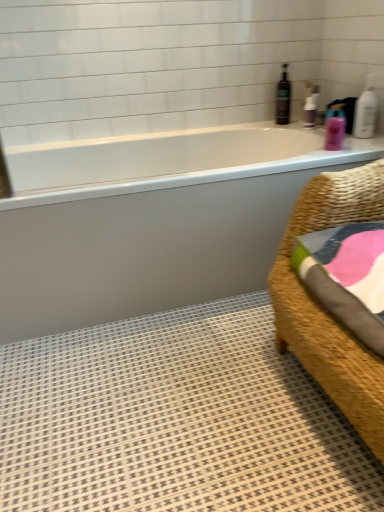
Question: Is white plastic pump at upper right, acting as the first toiletry starting from the back, facing away from white textured bath mat at lower right?

Choices:
 (A) no
 (B) yes

Answer: (A)

Question: Is white textured bath mat at lower right completely or partially inside white plastic pump at upper right, acting as the first toiletry starting from the back?

Choices:
 (A) no
 (B) yes

Answer: (A)

Question: Considering the relative sizes of white plastic pump at upper right, acting as the first toiletry starting from the back, and white textured bath mat at lower right in the image provided, is white plastic pump at upper right, acting as the first toiletry starting from the back, thinner than white textured bath mat at lower right?

Choices:
 (A) yes
 (B) no

Answer: (A)

Question: Is white plastic pump at upper right, acting as the first toiletry starting from the back, far from white textured bath mat at lower right?

Choices:
 (A) no
 (B) yes

Answer: (B)

Question: Can you confirm if white plastic pump at upper right, acting as the first toiletry starting from the back, is positioned to the left of white textured bath mat at lower right?

Choices:
 (A) yes
 (B) no

Answer: (B)

Question: Can you confirm if white plastic pump at upper right, placed as the 2th toiletry when sorted from bottom to top, is positioned to the right of white textured bath mat at lower right?

Choices:
 (A) no
 (B) yes

Answer: (B)

Question: Is brown glass bottle at upper right located within pink glossy lotion at upper right, the 1th toiletry in the bottom-to-top sequence?

Choices:
 (A) yes
 (B) no

Answer: (B)

Question: Considering the relative sizes of pink glossy lotion at upper right, the 1th toiletry in the bottom-to-top sequence, and brown glass bottle at upper right in the image provided, is pink glossy lotion at upper right, the 1th toiletry in the bottom-to-top sequence, shorter than brown glass bottle at upper right?

Choices:
 (A) yes
 (B) no

Answer: (A)

Question: Can you confirm if pink glossy lotion at upper right, the 1th toiletry in the bottom-to-top sequence, is bigger than brown glass bottle at upper right?

Choices:
 (A) no
 (B) yes

Answer: (A)

Question: Considering the relative sizes of pink glossy lotion at upper right, the 1th toiletry in the bottom-to-top sequence, and brown glass bottle at upper right in the image provided, is pink glossy lotion at upper right, the 1th toiletry in the bottom-to-top sequence, wider than brown glass bottle at upper right?

Choices:
 (A) yes
 (B) no

Answer: (A)

Question: Does pink glossy lotion at upper right, marked as the 2th toiletry in a back-to-front arrangement, have a smaller size compared to brown glass bottle at upper right?

Choices:
 (A) no
 (B) yes

Answer: (B)

Question: Is pink glossy lotion at upper right, the 1th toiletry in the bottom-to-top sequence, directly adjacent to brown glass bottle at upper right?

Choices:
 (A) yes
 (B) no

Answer: (B)

Question: Is white glossy bathtub at upper center oriented towards brown glass bottle at upper right?

Choices:
 (A) no
 (B) yes

Answer: (A)